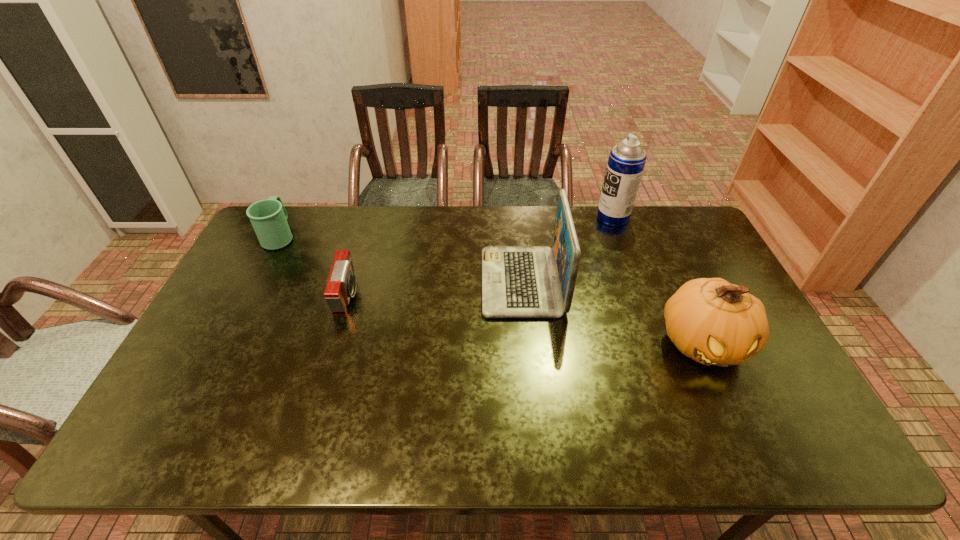
The width and height of the screenshot is (960, 540). I want to click on vacant area situated on the screen of the laptop computer, so click(383, 282).

Locate an element on the screen. Image resolution: width=960 pixels, height=540 pixels. vacant space located 0.280m on the screen of the laptop computer is located at coordinates 393,282.

Locate an element on the screen. The width and height of the screenshot is (960, 540). free space located on the screen of the laptop computer is located at coordinates (444, 282).

The width and height of the screenshot is (960, 540). Find the location of `vacant area located 0.050m on the front face of the pumpkin`. vacant area located 0.050m on the front face of the pumpkin is located at coordinates (729, 399).

Find the location of a particular element. The image size is (960, 540). blank space located 0.050m on the side of the second shortest object with the handle is located at coordinates (291, 214).

Locate an element on the screen. The image size is (960, 540). vacant region located 0.120m on the front-facing side of the shortest object is located at coordinates (396, 295).

This screenshot has height=540, width=960. Find the location of `aerosol can that is at the far edge`. aerosol can that is at the far edge is located at coordinates (626, 162).

Locate an element on the screen. mug present at the far edge is located at coordinates (268, 217).

Locate an element on the screen. object that is at the left edge is located at coordinates (268, 217).

This screenshot has height=540, width=960. Find the location of `object located in the right edge section of the desktop`. object located in the right edge section of the desktop is located at coordinates (714, 322).